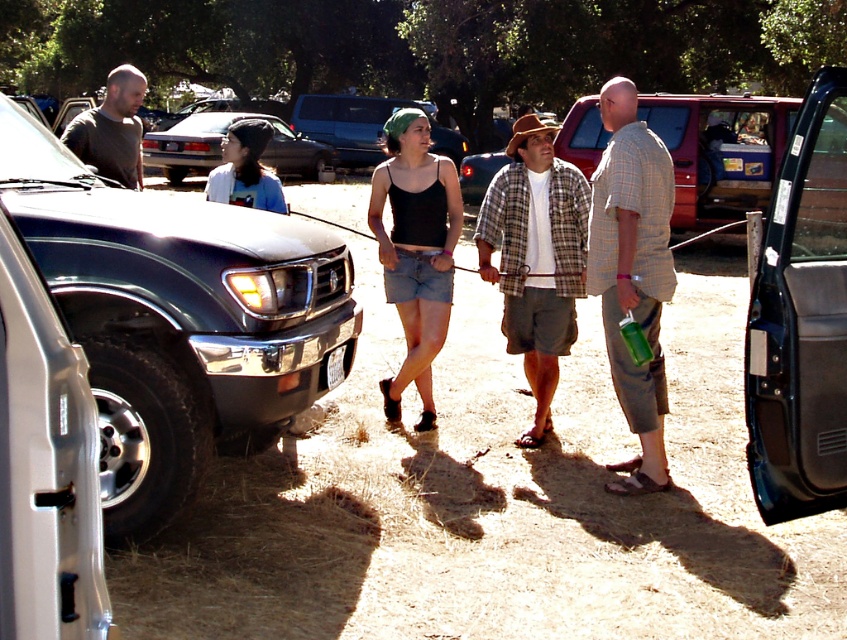
From the picture: You are trying to decide which item is wider between the metallic blue door at right and the matte gray shirt at left. Based on the scene, which one is wider?

The matte gray shirt at left is wider than the metallic blue door at right.

Please provide the 2D coordinates of the plaid fabric shirt at center in the image. The scene shows a parking lot with people and vehicles. You must use the object labels exactly as provided. Answer with the coordinates in the format of a point like this example format, e.g., point A is at point 0.1,0.2. Do not add any extra text or explanation.

The plaid fabric shirt at center is at point (535, 257).